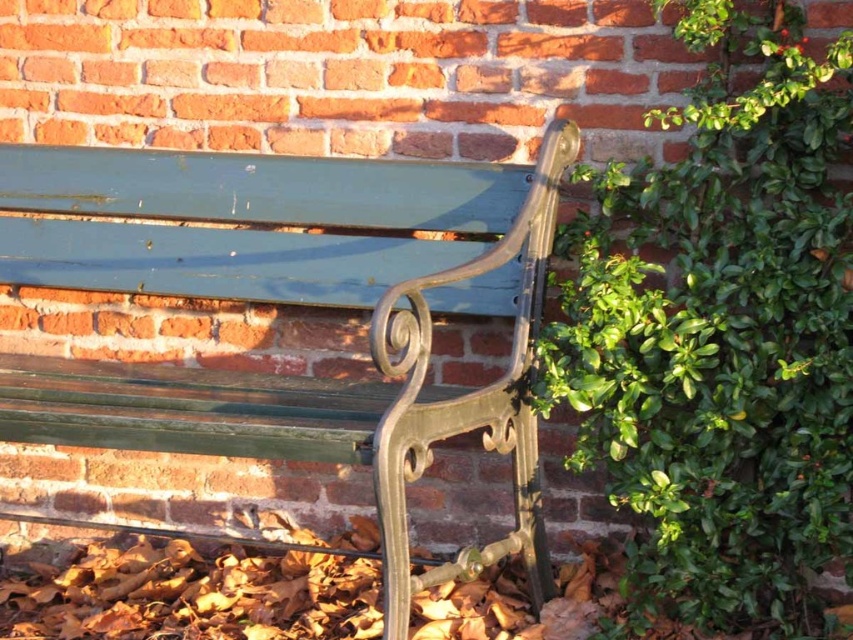
Question: Which point is closer to the camera taking this photo?

Choices:
 (A) (282, 186)
 (B) (780, 208)

Answer: (B)

Question: Does green leafy ivy at right have a smaller size compared to green painted wood bench at center?

Choices:
 (A) yes
 (B) no

Answer: (A)

Question: Which object is closer to the camera taking this photo?

Choices:
 (A) green painted wood bench at center
 (B) green leafy ivy at right

Answer: (A)

Question: Can you confirm if green leafy ivy at right is positioned to the left of green painted wood bench at center?

Choices:
 (A) no
 (B) yes

Answer: (A)

Question: Is the position of green leafy ivy at right more distant than that of green painted wood bench at center?

Choices:
 (A) no
 (B) yes

Answer: (B)